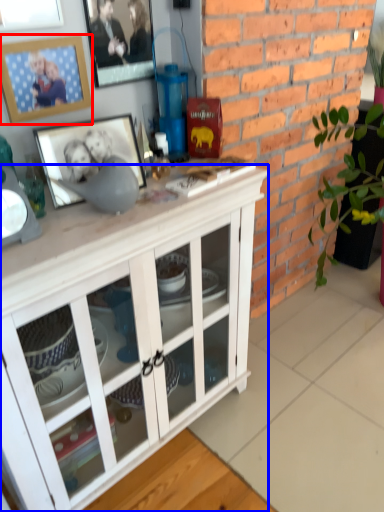
Question: Which object appears closest to the camera in this image, picture frame (highlighted by a red box) or cabinetry (highlighted by a blue box)?

Choices:
 (A) picture frame
 (B) cabinetry

Answer: (B)